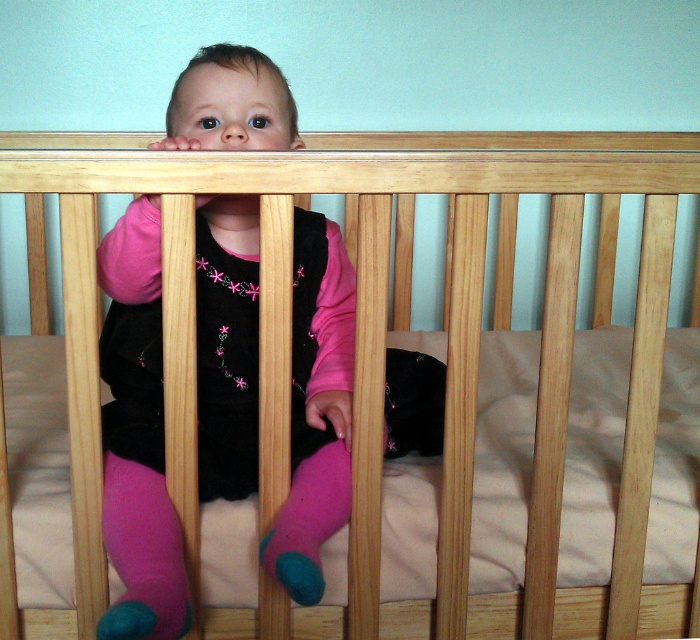
You are a photographer setting up a shot of the baby in the crib. You need to ensure that the matte black dress at center and the pink fuzzy sock at lower center are both visible in the frame. Given that your camera has a minimum focus distance of 8 inches, will you be able to capture both objects clearly without moving the camera closer?

The matte black dress at center is 7.25 inches from the pink fuzzy sock at lower center. Since the camera requires a minimum focus distance of 8 inches to focus on objects, the distance between them is less than required. Therefore, the camera may not be able to capture both objects clearly in focus simultaneously without adjusting the focus or moving closer.

You are a photographer setting up a shoot in the baby room. You need to place a small prop between the pink fabric sock at lower left and the pink fuzzy sock at lower center. Based on their heights, where should you place the prop to ensure it is visible above both socks?

The pink fabric sock at lower left is taller than the pink fuzzy sock at lower center. To ensure visibility above both, place the prop above the pink fabric sock at lower left since it is the taller one.

You are a photographer setting up a shoot in the room where the baby is in the crib. You need to place a matte black dress at center so it doesn not block the baby. Where should you place the dress?

The matte black dress at center should be placed at point (x=136, y=436) to avoid blocking the baby in the crib.